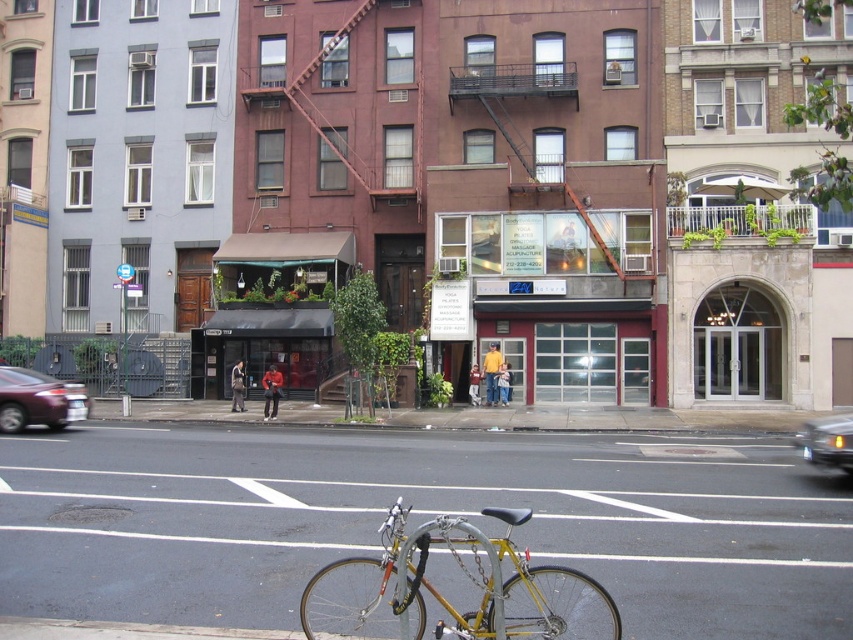
From the picture: Can you confirm if gold metallic bicycle at center is taller than matte black sedan at left?

In fact, gold metallic bicycle at center may be shorter than matte black sedan at left.

Who is positioned more to the left, gold metallic bicycle at center or matte black sedan at left?

matte black sedan at left is more to the left.

Identify the location of gold metallic bicycle at center. point(445,598).

Where is `gold metallic bicycle at center`? Image resolution: width=853 pixels, height=640 pixels. gold metallic bicycle at center is located at coordinates (445, 598).

Is gold metallic bicycle at center closer to the viewer compared to metallic silver car at center right?

That is True.

Between point (531, 632) and point (838, 429), which one is positioned in front?

Positioned in front is point (531, 632).

The width and height of the screenshot is (853, 640). Find the location of `gold metallic bicycle at center`. gold metallic bicycle at center is located at coordinates (445, 598).

Can you confirm if matte black sedan at left is taller than metallic silver car at center right?

Incorrect, matte black sedan at left's height is not larger of metallic silver car at center right's.

Consider the image. Is matte black sedan at left closer to the viewer compared to metallic silver car at center right?

No, it is behind metallic silver car at center right.

Who is more forward, (x=45, y=410) or (x=844, y=438)?

Point (x=844, y=438) is in front.

Where is `matte black sedan at left`? This screenshot has height=640, width=853. matte black sedan at left is located at coordinates (38, 401).